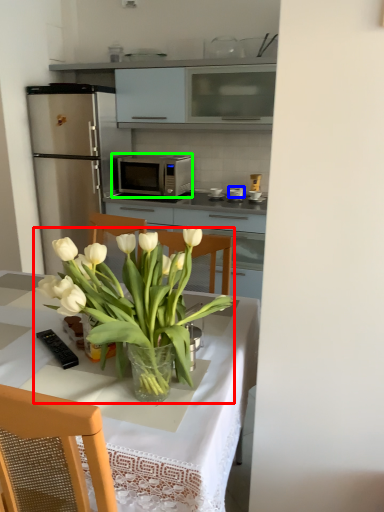
Question: Considering the real-world distances, which object is closest to houseplant (highlighted by a red box)? appliance (highlighted by a blue box) or microwave oven (highlighted by a green box).

Choices:
 (A) appliance
 (B) microwave oven

Answer: (B)